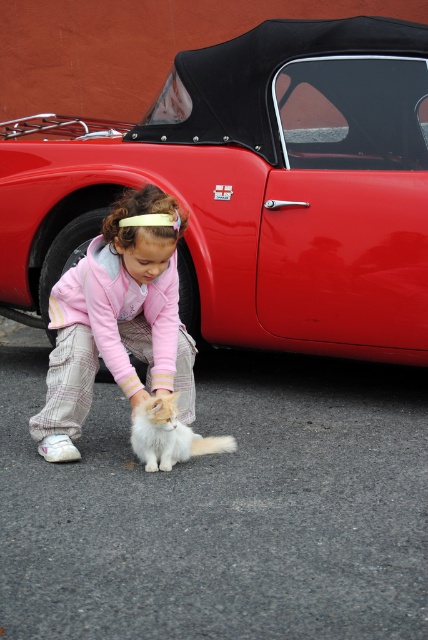
You are a photographer trying to capture a closeup of the white fluffy cat at lower center without including the pink fleece jacket at center in the frame. Based on their positions, is this possible?

The pink fleece jacket at center might be wider than white fluffy cat at lower center, so there is a possibility that the jacket could block the cat if they are positioned closely. To ensure the cat is framed without the jacket, adjust the angle or distance to avoid overlap.

You are a photographer trying to capture a photo of the shiny red car at center and the pink fleece jacket at center. Since you want to emphasize the car, which object should you place closer to the camera to make it appear bigger in the photo?

To emphasize the shiny red car at center, you should place it closer to the camera because objects closer to the camera appear larger in the photo. However, according to the description, the shiny red car at center already has a larger size compared to the pink fleece jacket at center, so positioning it closer would enhance its prominence further.

You are a delivery robot that needs to deliver a package to the shiny red car at center. You are currently at the white fluffy cat at lower center. Can you move directly to the car without any obstacles between them?

The distance between the shiny red car at center and the white fluffy cat at lower center is 4.31 feet. Since there are no obstacles mentioned in the scene description, the robot can move directly to the car.